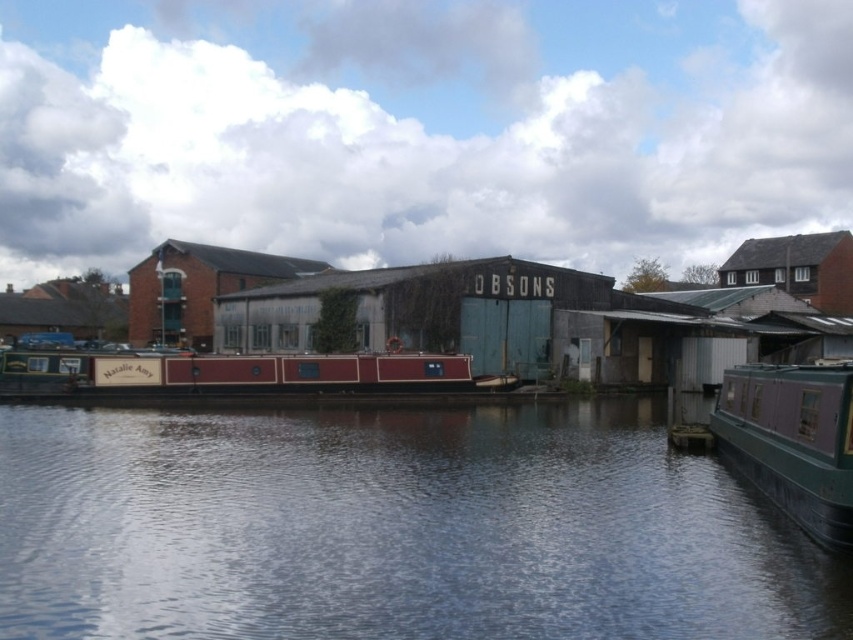
You are a photographer standing on the green matte barge at right and want to take a photo of the smooth water at center. Considering the height difference between the two, will the water be visible in your photo without any obstructions?

The smooth water at center is not as tall as the green matte barge at right, so the water will be visible in your photo without any obstructions because it is lower than the barge.

You are standing on the riverside path and want to take a photo of the smooth water at center and the green matte barge at right. Which object should you focus on first to ensure it appears sharp in the foreground?

You should focus on the smooth water at center first because it is in front of the green matte barge at right, making it closer to the camera and thus the foreground element.

You are standing on the riverbank and see the smooth water at center and the green matte barge at right. Which object is closer to the left side of the image?

The smooth water at center is to the left of the green matte barge at right, so it is closer to the left side of the image.